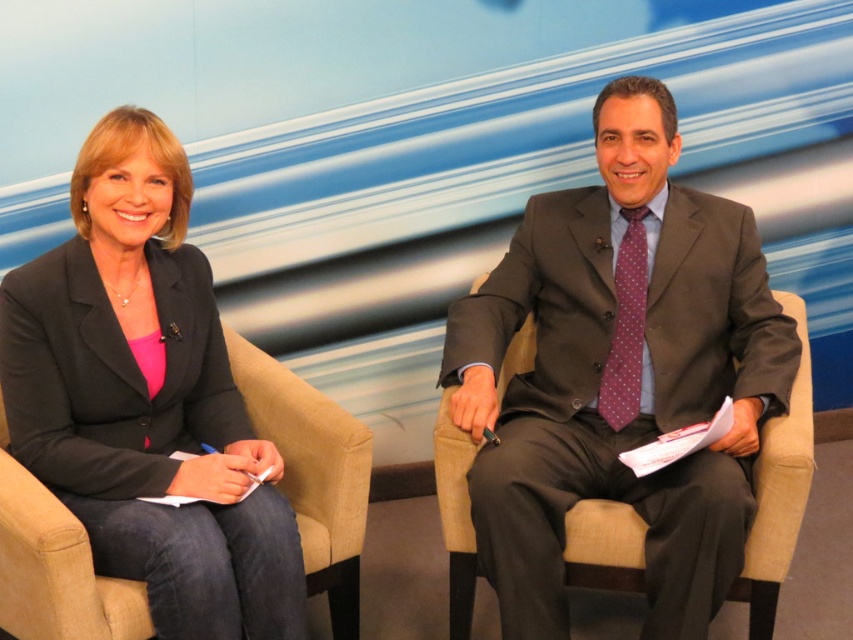
Does point (508, 576) lie in front of point (129, 456)?

No, (508, 576) is further to viewer.

Does matte gray suit at right have a greater height compared to matte black blazer at left?

Yes.

Between point (752, 320) and point (234, 598), which one is positioned in front?

Point (234, 598)

Find the location of a particular element. matte gray suit at right is located at coordinates (619, 374).

Can you confirm if matte gray suit at right is wider than purple dotted fabric tie at right?

Correct, the width of matte gray suit at right exceeds that of purple dotted fabric tie at right.

This screenshot has width=853, height=640. What do you see at coordinates (619, 374) in the screenshot? I see `matte gray suit at right` at bounding box center [619, 374].

Where is `matte gray suit at right`? The image size is (853, 640). matte gray suit at right is located at coordinates (619, 374).

Does matte black blazer at left lie behind purple dotted fabric tie at right?

No.

Between point (177, 157) and point (625, 214), which one is positioned behind?

The point (625, 214) is more distant.

Identify the location of matte black blazer at left. (146, 397).